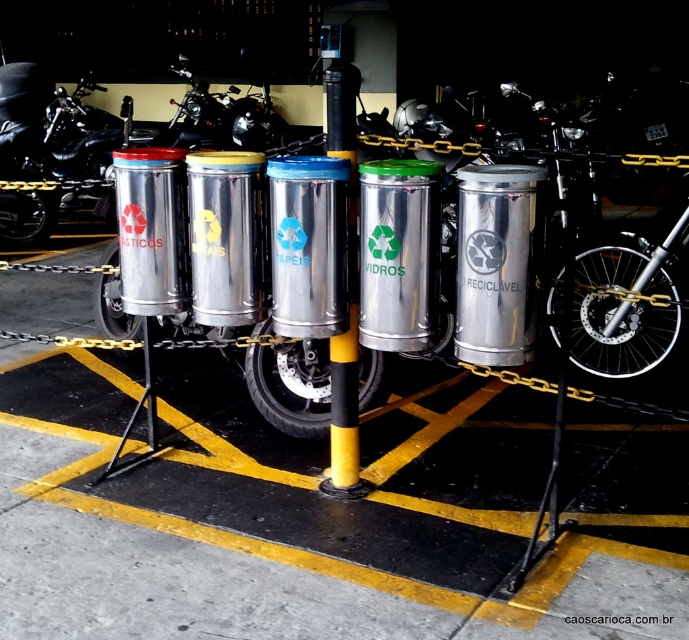
Question: Which of the following is the farthest from the observer?

Choices:
 (A) shiny black motorcycle at center
 (B) brushed metal motorcycle at center
 (C) yellow matte pole at center

Answer: (B)

Question: Based on their relative distances, which object is nearer to the yellow matte pole at center?

Choices:
 (A) shiny black motorcycle at center
 (B) brushed metal motorcycle at center

Answer: (A)

Question: Is shiny black motorcycle at center to the right of yellow matte pole at center from the viewer's perspective?

Choices:
 (A) no
 (B) yes

Answer: (A)

Question: Does shiny black motorcycle at center appear under brushed metal motorcycle at center?

Choices:
 (A) no
 (B) yes

Answer: (B)

Question: Which of the following is the closest to the observer?

Choices:
 (A) (329, 106)
 (B) (17, 176)
 (C) (178, 109)

Answer: (A)

Question: Is shiny black motorcycle at center wider than yellow matte pole at center?

Choices:
 (A) yes
 (B) no

Answer: (A)